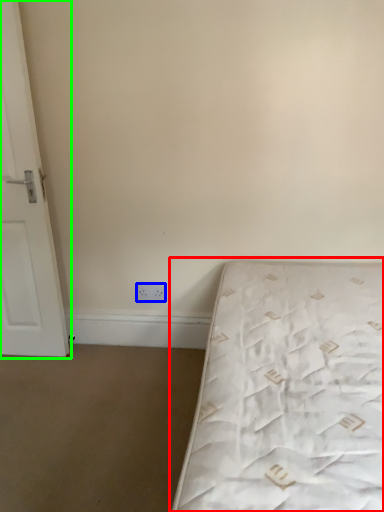
Question: Considering the real-world distances, which object is farthest from bed (highlighted by a red box)? electric outlet (highlighted by a blue box) or door (highlighted by a green box)?

Choices:
 (A) electric outlet
 (B) door

Answer: (B)